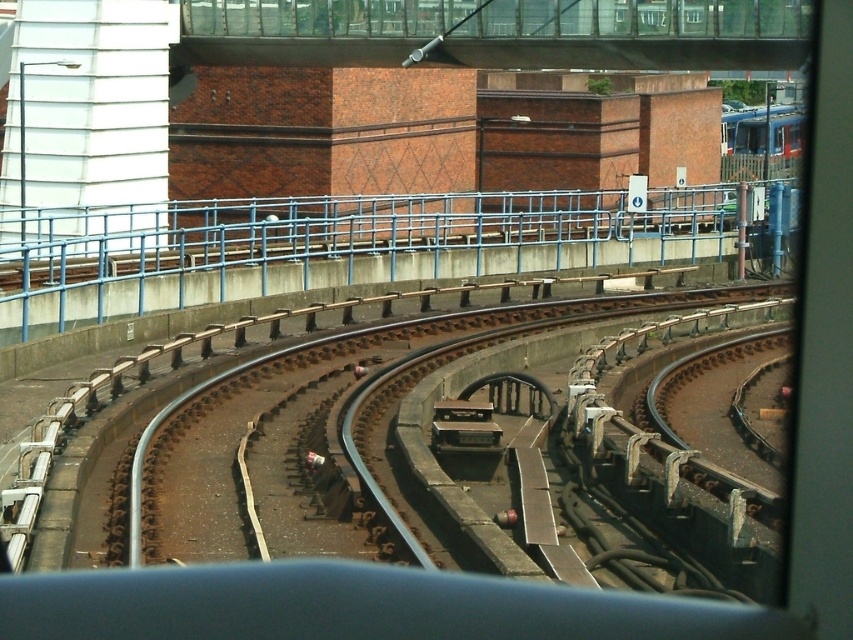
Which is below, blue metallic rail at upper center or blue metallic train at upper right?

Positioned lower is blue metallic rail at upper center.

Which is in front, point (239, 241) or point (740, 134)?

Point (239, 241) is more forward.

Find the location of a particular element. blue metallic rail at upper center is located at coordinates (366, 250).